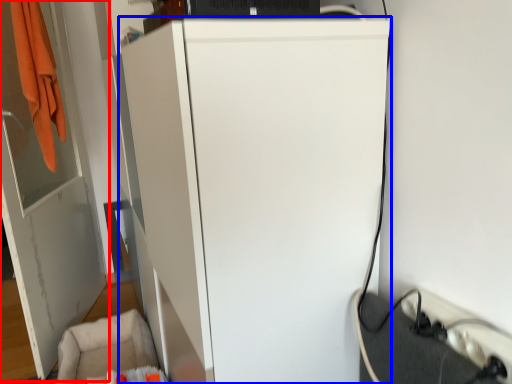
Question: Among these objects, which one is farthest to the camera, door (highlighted by a red box) or refrigerator (highlighted by a blue box)?

Choices:
 (A) door
 (B) refrigerator

Answer: (A)